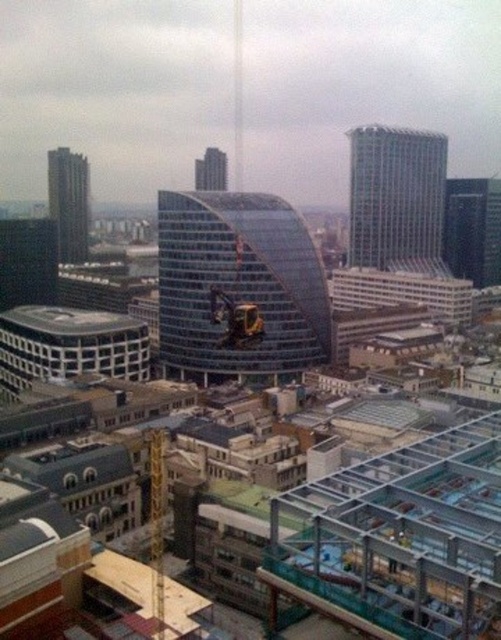
You are a city planner reviewing this area. There are two buildings of interest here, the transparent glass building at center and the glassy steel skyscraper at center. You need to install a new communication tower between them. What is the minimum distance the tower must cover to connect both buildings?

The transparent glass building at center and the glassy steel skyscraper at center are 260.71 meters apart from each other. The communication tower must cover at least 260.71 meters to connect both buildings.

You are an architect reviewing a city layout. You observe the transparent glass building at center and the glassy steel skyscraper at center. Which one is located to the right of the other?

The transparent glass building at center is positioned on the right side of the glassy steel skyscraper at center.